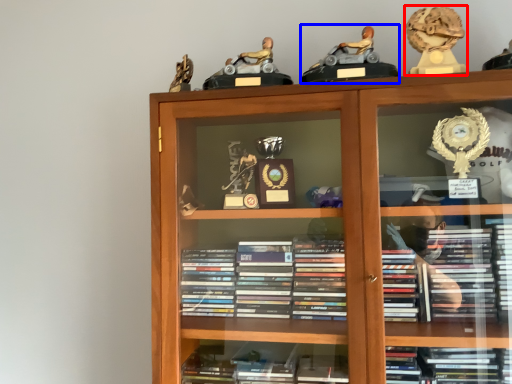
Question: Which object is further to the camera taking this photo, toy (highlighted by a red box) or toy (highlighted by a blue box)?

Choices:
 (A) toy
 (B) toy

Answer: (A)